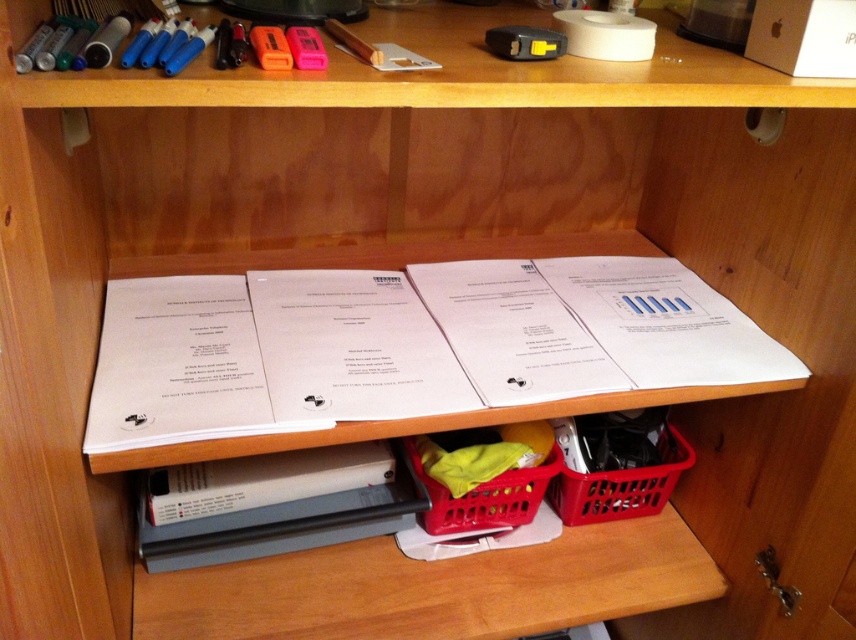
You are standing in front of a wooden shelf unit with two open shelves. The top shelf has colorful markers, a roll of tape, a black stapler, and a small box. The middle of the top shelf has a white object that looks like a piece of paper or a small folder. The second shelf has papers with text and diagrams, and two red plastic baskets below them. One basket has a yellow cloth and the other is empty. Now, if you want to place a new item exactly at the position of wooden shelf at lower center, where would you

The wooden shelf at lower center is located at coordinates point (434, 588). Since the wooden shelf at lower center is already at that position, placing another item there would require removing the existing shelf or choosing a different location.

You are organizing a storage area and need to place a new item that requires 5 inches of space between two red plastic baskets. Looking at the image, are the red plastic basket at lower center and the red plastic basket at center positioned in a way that allows for this requirement?

The red plastic basket at lower center is 4.82 inches away from the red plastic basket at center, which is less than the required 5 inches. Therefore, the space between them is insufficient for placing the new item.

You are organizing a workspace and need to place a new document on the shelf. The document must be placed in front of the black plastic file at lower center and behind the red plastic basket at lower center. Is this possible? Explain why or why not.

The black plastic file at lower center is closer to the viewer than the red plastic basket at lower center. Since the document needs to be placed both in front of the black plastic file and behind the red plastic basket, this is not possible because the black plastic file is already in front of the red plastic basket. The document cannot be both in front of an object and behind another object that is further away simultaneously.